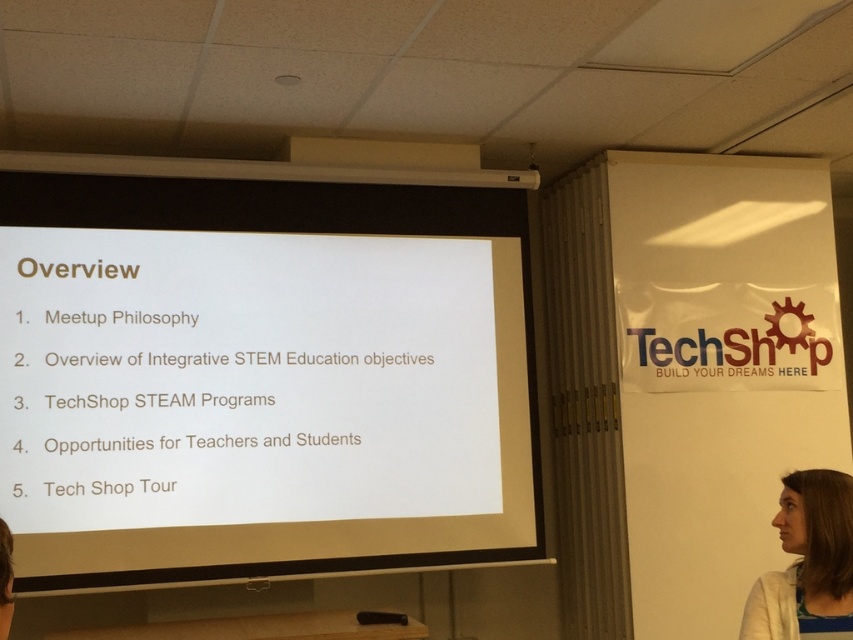
Between white paper at center and white knitwear at lower right, which one has more height?

With more height is white paper at center.

Between white paper at center and white knitwear at lower right, which one is positioned higher?

white paper at center is higher up.

Is point (294, 301) closer to camera compared to point (845, 573)?

That is False.

I want to click on white paper at center, so click(x=262, y=378).